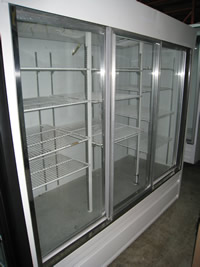
The width and height of the screenshot is (200, 267). In order to click on white metallic area at bottom of fridge in this screenshot , I will do `click(102, 254)`.